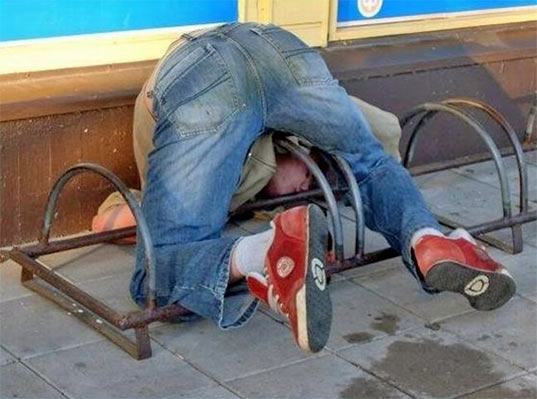
Where is `floor`? Image resolution: width=537 pixels, height=399 pixels. floor is located at coordinates (250, 381).